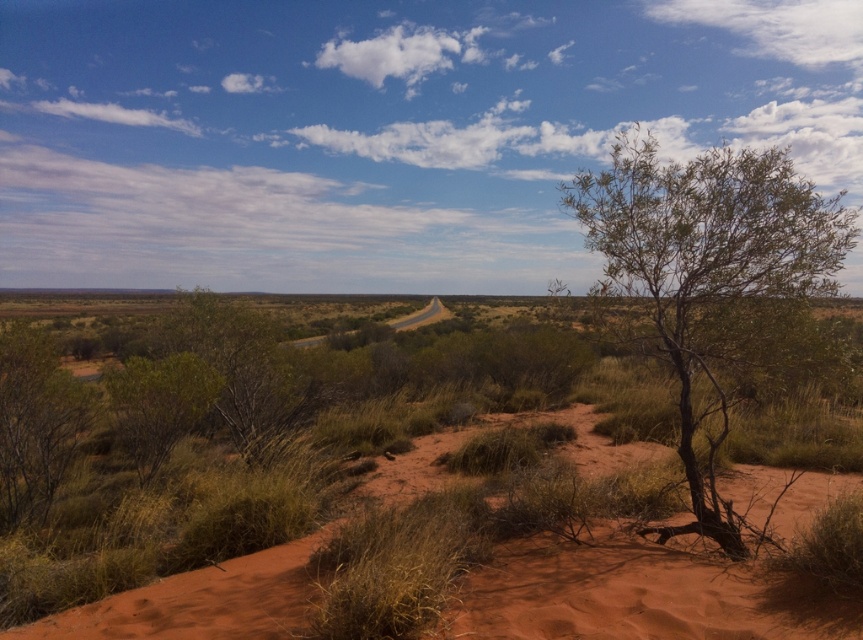
Question: Considering the real-world distances, which object is farthest from the dried reddish-brown dirt track at center?

Choices:
 (A) green leafy tree at right
 (B) green leafy shrub at left

Answer: (A)

Question: Can you confirm if dried reddish-brown dirt track at center is positioned below green leafy tree at right?

Choices:
 (A) yes
 (B) no

Answer: (A)

Question: Which point is closer to the camera?

Choices:
 (A) (690, 276)
 (B) (49, 381)

Answer: (A)

Question: Is dried reddish-brown dirt track at center positioned before green leafy shrub at left?

Choices:
 (A) yes
 (B) no

Answer: (A)

Question: Which of the following is the closest to the observer?

Choices:
 (A) (41, 384)
 (B) (734, 596)

Answer: (B)

Question: Is green leafy tree at right below green leafy shrub at left?

Choices:
 (A) no
 (B) yes

Answer: (A)